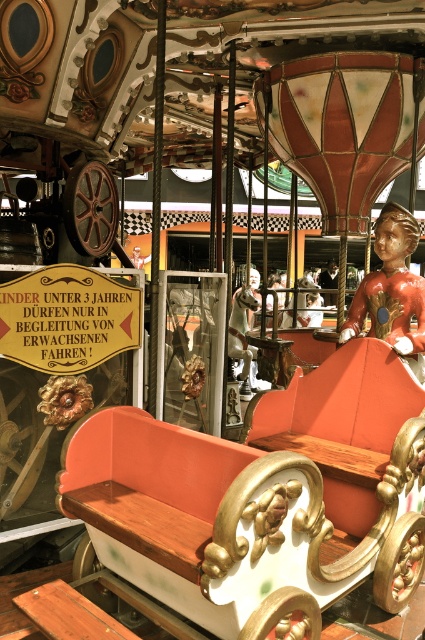
Who is higher up, wooden bench at center or shiny gold statue at center?

shiny gold statue at center

Identify the location of wooden bench at center. The image size is (425, 640). (258, 499).